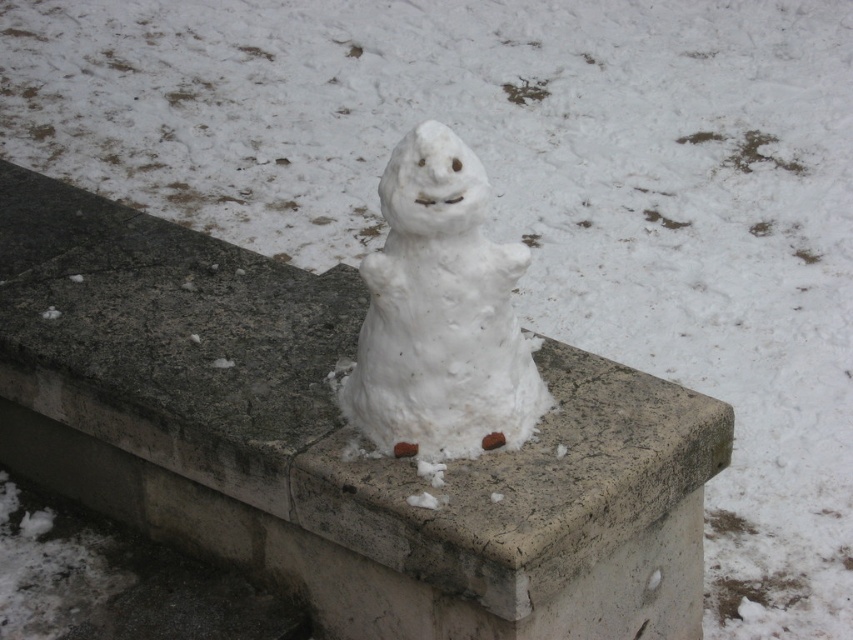
From the picture: Which is above, concrete at center or white matte snowman at center?

white matte snowman at center is above.

The width and height of the screenshot is (853, 640). I want to click on concrete at center, so click(331, 440).

Is point (601, 540) farther from camera compared to point (451, 456)?

No, it is in front of (451, 456).

You are a GUI agent. You are given a task and a screenshot of the screen. Output one action in this format:
    pyautogui.click(x=<x>, y=<y>)
    Task: Click on the concrete at center
    This screenshot has height=640, width=853.
    Given the screenshot: What is the action you would take?
    pyautogui.click(x=331, y=440)